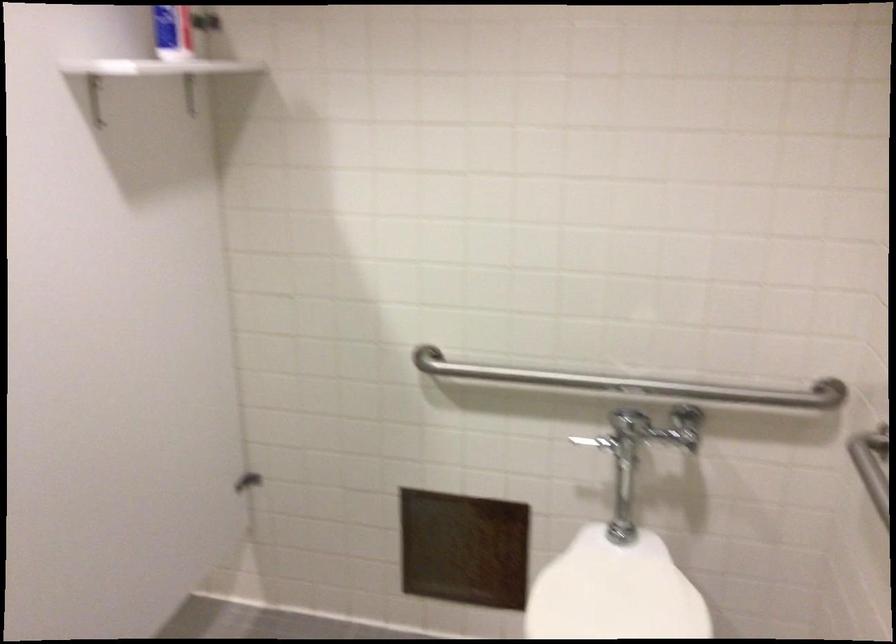
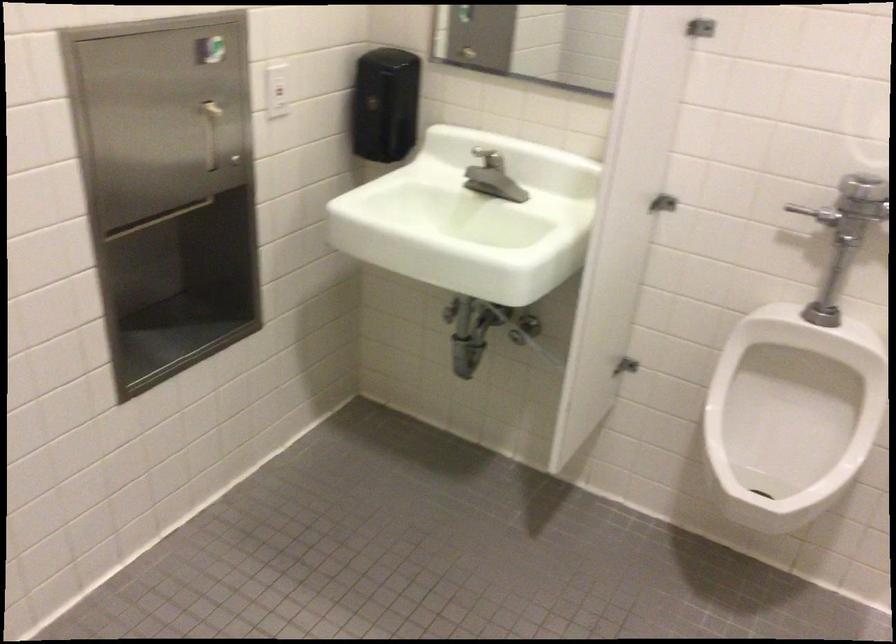
Question: The images are taken continuously from a first-person perspective. In which direction are you moving?

Choices:
 (A) Left
 (B) Right
 (C) Forward
 (D) Backward

Answer: (A)